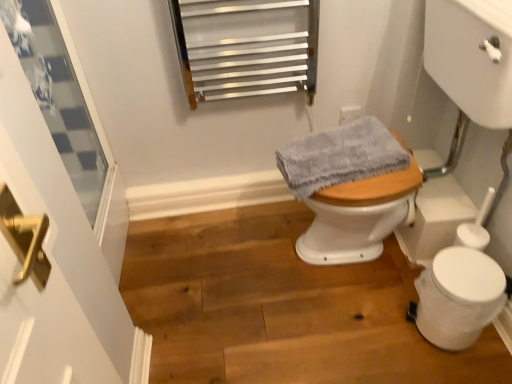
Identify the location of vacant space to the left of white plastic toilet bowl at lower right. (382, 330).